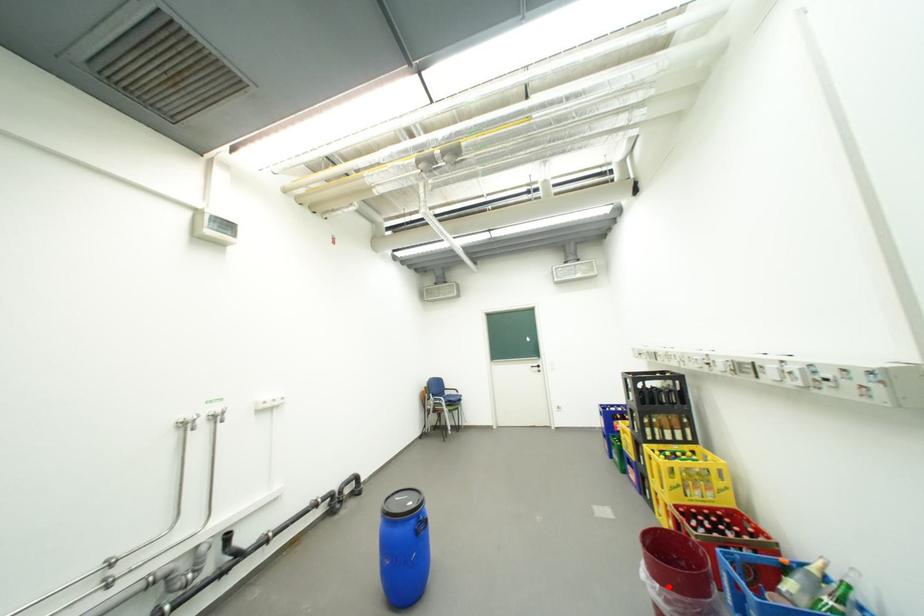
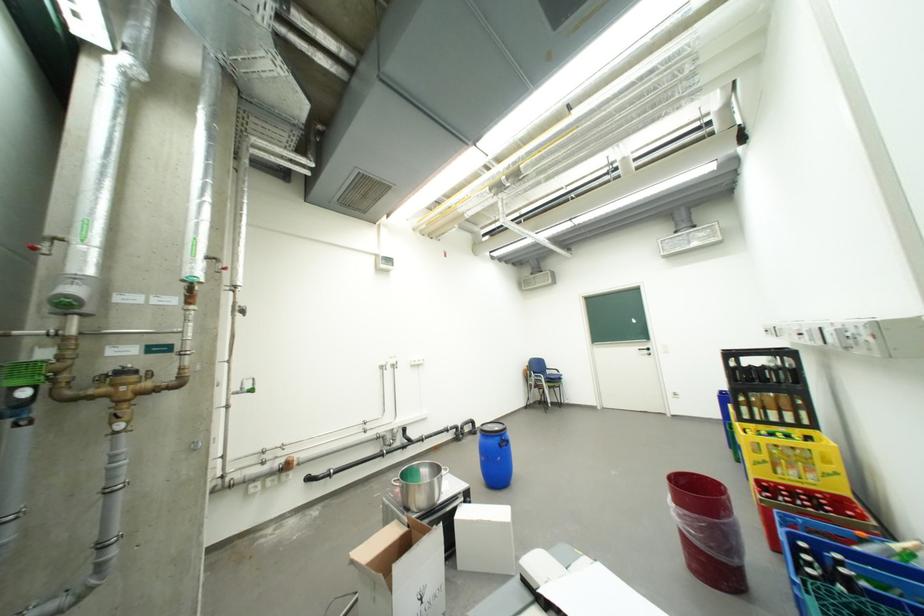
The point at the highlighted location is marked in the first image. Where is the corresponding point in the second image?

(685, 507)